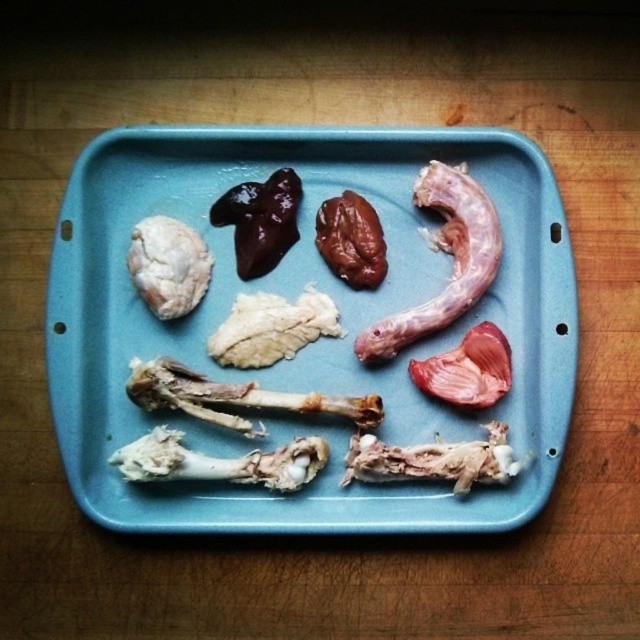
Question: Which of the following is the farthest from the observer?

Choices:
 (A) (401, 477)
 (B) (140, 464)

Answer: (A)

Question: Which of these objects is positioned farthest from the white soft heart at upper left?

Choices:
 (A) blue plastic tray at center
 (B) white bone at bottom
 (C) pink soft tissue at center
 (D) white bone at bottom left

Answer: (C)

Question: Is white bone at bottom left further to the viewer compared to pink soft tissue at center?

Choices:
 (A) yes
 (B) no

Answer: (B)

Question: Which of the following is the closest to the observer?

Choices:
 (A) (134, 228)
 (B) (372, 289)

Answer: (A)

Question: Can you confirm if white fluffy meat at center is bigger than white soft heart at upper left?

Choices:
 (A) yes
 (B) no

Answer: (A)

Question: Can you confirm if white bone at bottom is positioned above white soft heart at upper left?

Choices:
 (A) no
 (B) yes

Answer: (A)